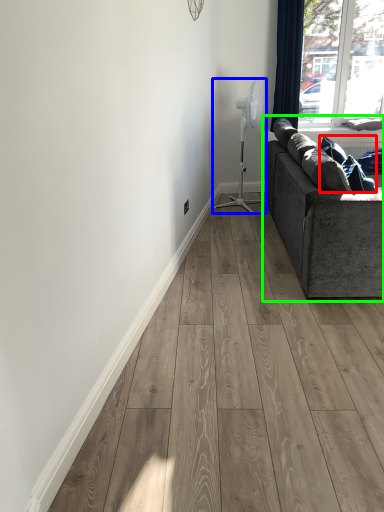
Question: Which object is the farthest from pillow (highlighted by a red box)? Choose among these: fan (highlighted by a blue box) or studio couch (highlighted by a green box).

Choices:
 (A) fan
 (B) studio couch

Answer: (A)